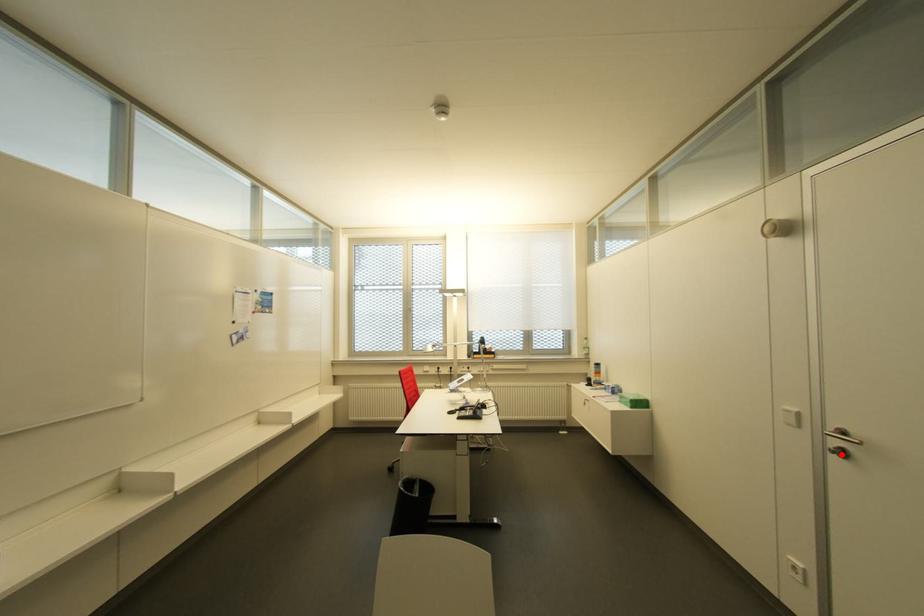
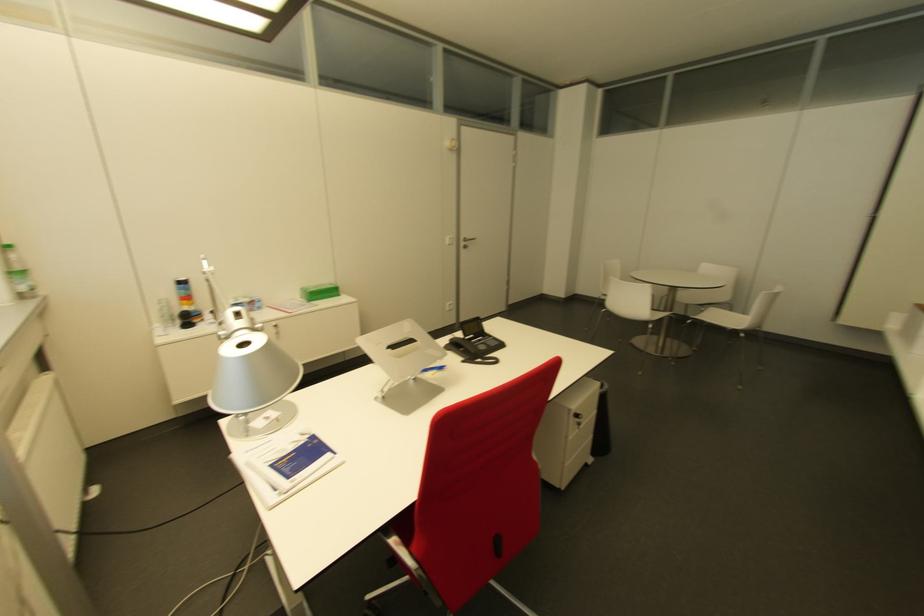
Find the pixel in the second image that matches the highlighted location in the first image.

(463, 246)